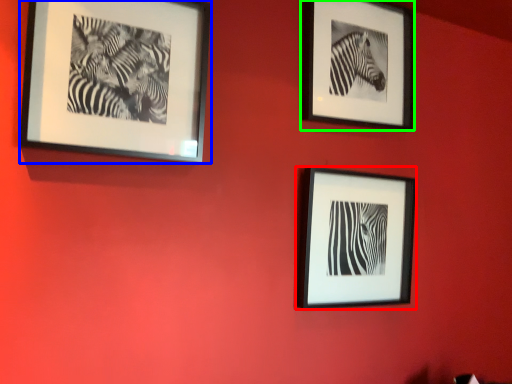
Question: Based on their relative distances, which object is nearer to picture frame (highlighted by a red box)? Choose from picture frame (highlighted by a blue box) and picture frame (highlighted by a green box).

Choices:
 (A) picture frame
 (B) picture frame

Answer: (B)